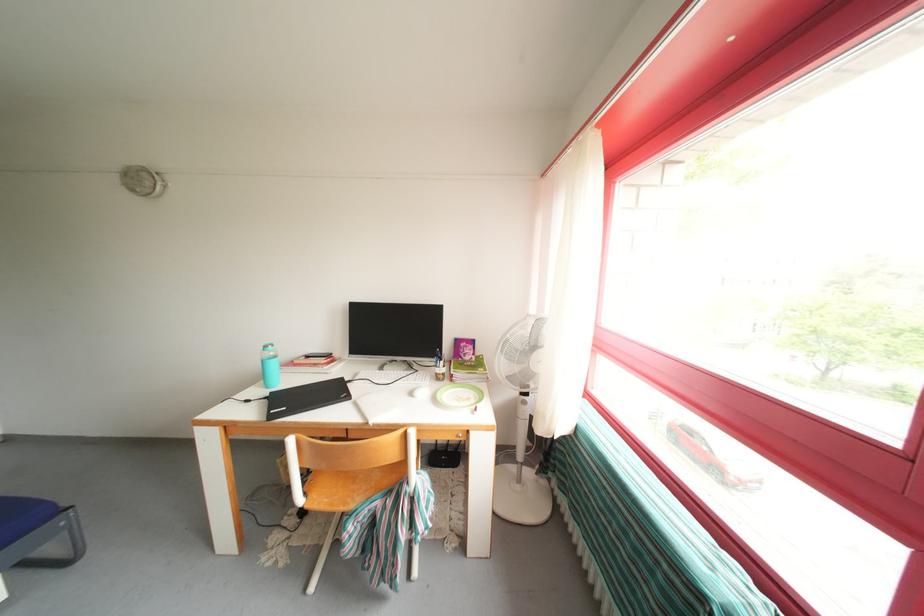
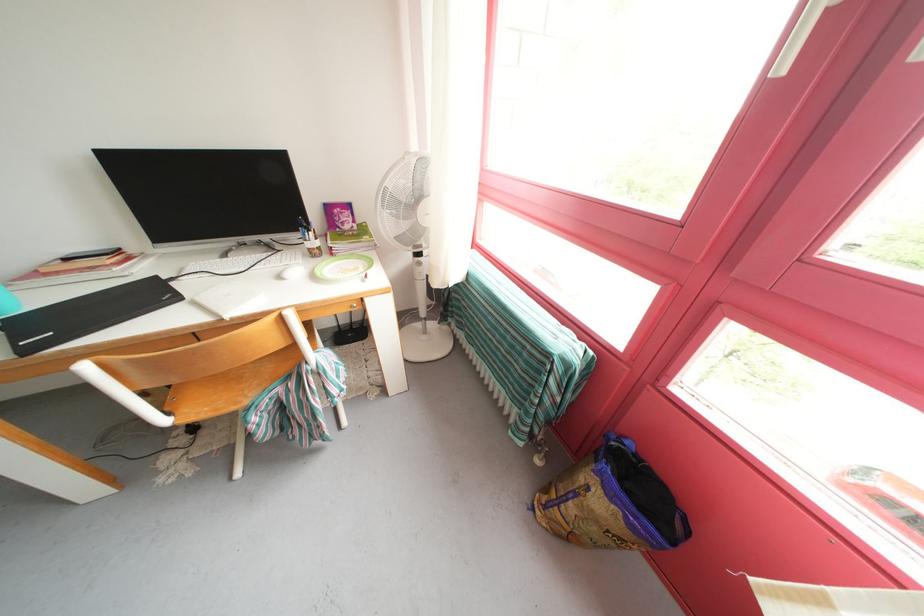
Locate, in the second image, the point that corresponds to (531,408) in the first image.

(427, 270)